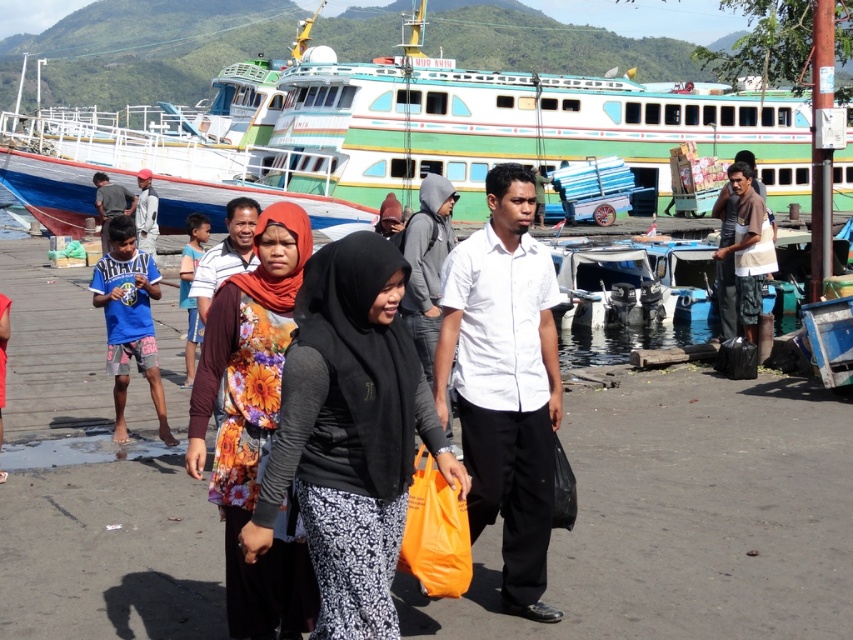
Question: Which point is closer to the camera?

Choices:
 (A) clear water at dock center
 (B) green painted wooden boat at upper center

Answer: (A)

Question: Can you confirm if white matte shirt at center is smaller than brown cotton shirt at right?

Choices:
 (A) no
 (B) yes

Answer: (A)

Question: Which object is positioned closest to the floral fabric scarf at center?

Choices:
 (A) floral fabric shirt at center
 (B) blue cotton shirt at left

Answer: (A)

Question: Can you confirm if green painted wooden boat at upper center is positioned to the left of dark gray shirt at left?

Choices:
 (A) yes
 (B) no

Answer: (B)

Question: In this image, where is white matte shirt at center located relative to clear water at dock center?

Choices:
 (A) left
 (B) right

Answer: (A)

Question: Which object is farther from the camera taking this photo?

Choices:
 (A) black matte hijab at center
 (B) floral fabric scarf at center
 (C) white matte shirt at center
 (D) blue cotton shirt at left

Answer: (D)